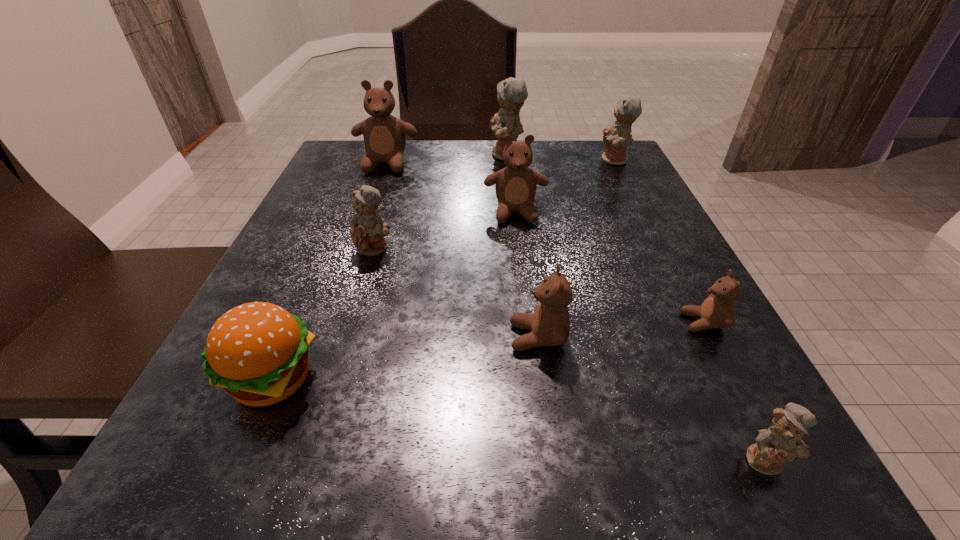
At what (x,y) coordinates should I click in order to perform the action: click on free space located 0.400m on the front-facing side of the second biggest brown teddy bear. Please return your answer as a coordinate pair (x, y). This screenshot has width=960, height=540. Looking at the image, I should click on (538, 415).

Where is `vacant space located 0.300m on the front-facing side of the leftmost blue teddy bear`? vacant space located 0.300m on the front-facing side of the leftmost blue teddy bear is located at coordinates (326, 412).

Locate an element on the screen. The image size is (960, 540). vacant space situated 0.060m on the front-facing side of the second smallest brown teddy bear is located at coordinates (468, 337).

This screenshot has width=960, height=540. In order to click on vacant space located on the front-facing side of the second smallest brown teddy bear in this screenshot , I will do `click(250, 337)`.

This screenshot has height=540, width=960. Identify the location of free space located on the front-facing side of the second smallest brown teddy bear. [228, 337].

Locate an element on the screen. This screenshot has height=540, width=960. free location located 0.230m on the right of the hamburger is located at coordinates (496, 379).

Image resolution: width=960 pixels, height=540 pixels. In order to click on free space located 0.300m on the front-facing side of the smallest brown teddy bear in this screenshot , I will do `click(479, 322)`.

At what (x,y) coordinates should I click in order to perform the action: click on vacant space located on the front-facing side of the smallest brown teddy bear. Please return your answer as a coordinate pair (x, y). The image size is (960, 540). Looking at the image, I should click on (642, 322).

You are a GUI agent. You are given a task and a screenshot of the screen. Output one action in this format:
    pyautogui.click(x=<x>, y=<y>)
    Task: Click on the free spot located 0.350m on the front-facing side of the smallest brown teddy bear
    The image size is (960, 540).
    Given the screenshot: What is the action you would take?
    pyautogui.click(x=444, y=322)

This screenshot has height=540, width=960. Identify the location of object that is at the near edge. (782, 440).